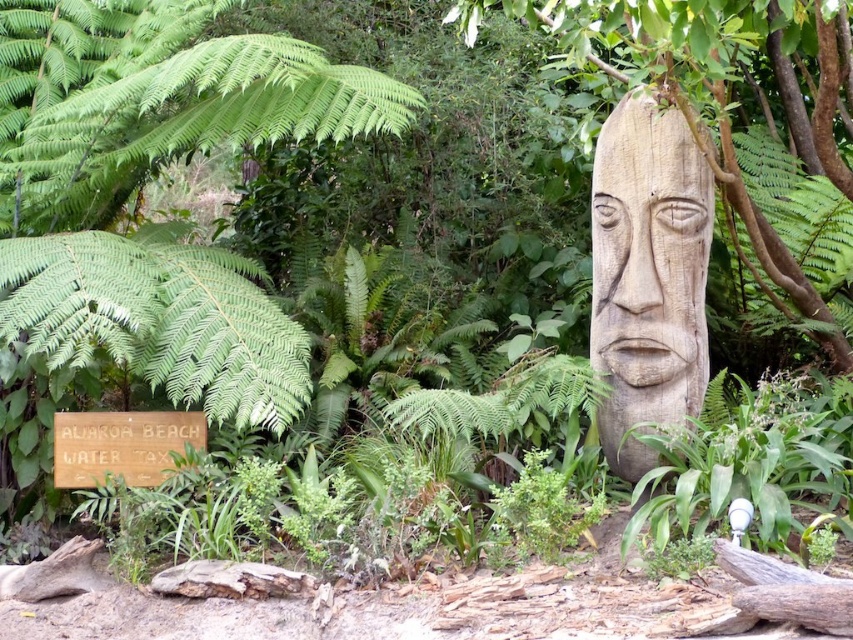
You are an artist planning to paint a scene that includes the wooden carving at center and the wooden sign at lower left. You want to ensure that the proportions of these objects in your painting match their actual sizes. Based on the scene, which object should you draw wider in your painting?

The wooden sign at lower left should be drawn wider in the painting since the wooden carving at center has a lesser width compared to the wooden sign at lower left.

You are planning to take a photo of the wooden carving at center and the wooden sign at lower left. To ensure both are fully visible in the frame, which object should you position closer to the camera?

The wooden carving at center is taller than the wooden sign at lower left, so you should position the wooden carving at center closer to the camera to ensure both are fully visible in the frame.